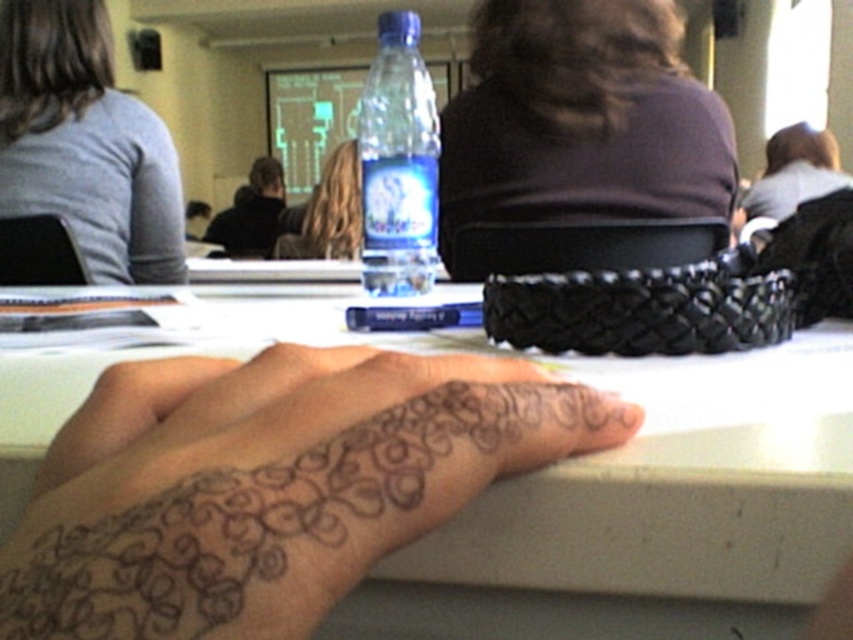
You are a photographer adjusting your camera settings to focus on the objects in the scene. Which object should you focus on first if you want to capture both the gray cotton sleeve at upper left and the black fabric jacket at upper center in sharp detail?

You should focus on the gray cotton sleeve at upper left first because it is closer to the viewer than the black fabric jacket at upper center. By focusing on the closer object, you can ensure both are in focus using a smaller aperture for a deeper depth of field.

Consider the image. You are standing in the classroom and want to determine which of the two points, point (426, 216) or point (277, 163), is nearer to you. Based on the scene description, which point is closer?

Point (426, 216) is closer to the viewer than point (277, 163).

You are a photographer setting up a shot in this classroom scene. You want to ensure both the gray cotton sleeve at upper left and the black fabric jacket at upper center are in focus. Given that your camera has a depth of field that can cover objects within a 3 meter range, will both items stay in focus?

The gray cotton sleeve at upper left and black fabric jacket at upper center are 2.98 meters apart from each other. Since the distance between them is within the 3 meter range of the camera, both items will stay in focus.